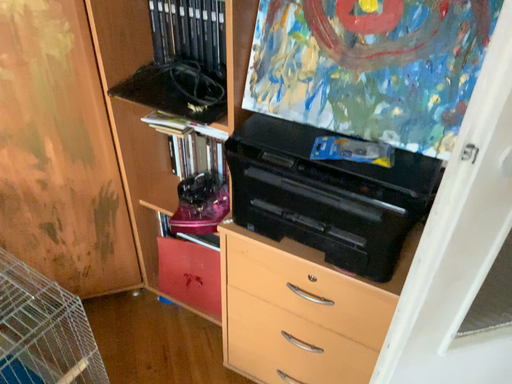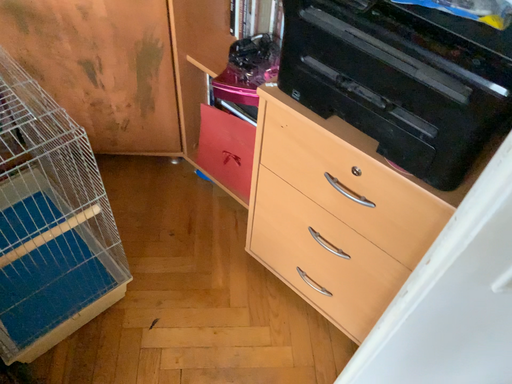
Question: Which way did the camera rotate in the video?

Choices:
 (A) rotated downward
 (B) rotated upward

Answer: (A)